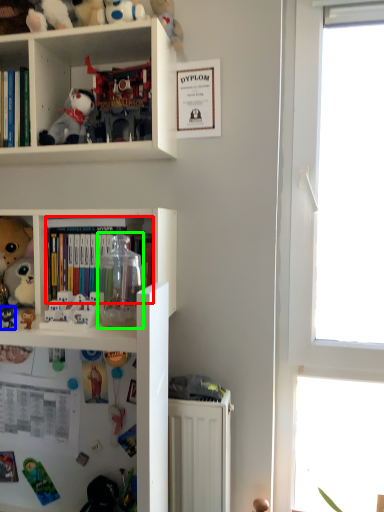
Question: Which object is positioned farthest from book (highlighted by a red box)? Select from toy (highlighted by a blue box) and glass jar (highlighted by a green box).

Choices:
 (A) toy
 (B) glass jar

Answer: (A)